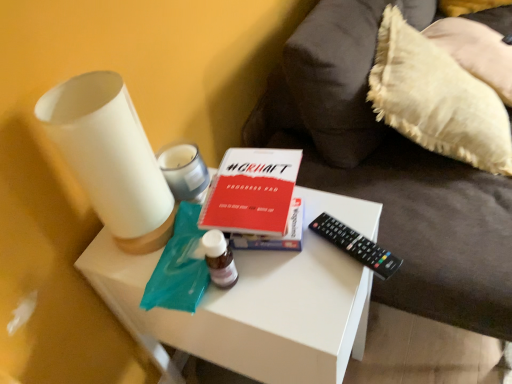
This screenshot has height=384, width=512. Find the location of `free space between black plastic remote at right and red matte progress pad at center`. free space between black plastic remote at right and red matte progress pad at center is located at coordinates (334, 236).